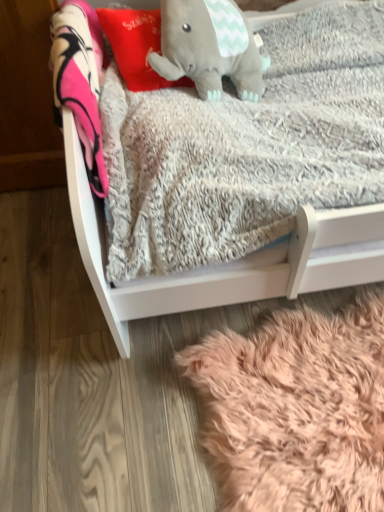
Describe the element at coordinates (232, 262) in the screenshot. The image size is (384, 512). I see `white soft wood infant bed at center` at that location.

Where is `fuzzy pink rug at lower right`? fuzzy pink rug at lower right is located at coordinates (296, 409).

What do you see at coordinates (296, 409) in the screenshot?
I see `fuzzy pink rug at lower right` at bounding box center [296, 409].

Describe the element at coordinates (136, 46) in the screenshot. This screenshot has height=512, width=384. I see `red plush pillow at upper center` at that location.

Image resolution: width=384 pixels, height=512 pixels. What are the coordinates of `white soft wood infant bed at center` in the screenshot? It's located at (232, 262).

Is gray plush elephant at upper center far away from fuzzy pink rug at lower right?

No, gray plush elephant at upper center is in close proximity to fuzzy pink rug at lower right.

Is gray plush elephant at upper center outside of fuzzy pink rug at lower right?

Yes, gray plush elephant at upper center is not within fuzzy pink rug at lower right.

Does gray plush elephant at upper center have a lesser width compared to fuzzy pink rug at lower right?

Yes, gray plush elephant at upper center is thinner than fuzzy pink rug at lower right.

From the image's perspective, relative to fuzzy pink rug at lower right, is gray plush elephant at upper center above or below?

Clearly, from the image's perspective, gray plush elephant at upper center is above fuzzy pink rug at lower right.

Is red plush pillow at upper center further to camera compared to fuzzy pink rug at lower right?

Yes, red plush pillow at upper center is behind fuzzy pink rug at lower right.

You are a GUI agent. You are given a task and a screenshot of the screen. Output one action in this format:
    pyautogui.click(x=<x>, y=<y>)
    Task: Click on the blanket that is in front of the red plush pillow at upper center
    
    Given the screenshot: What is the action you would take?
    pyautogui.click(x=296, y=409)

Is point (123, 70) in front of point (277, 413)?

No.

From a real-world perspective, who is located lower, red plush pillow at upper center or white soft wood infant bed at center?

white soft wood infant bed at center.

Does red plush pillow at upper center turn towards white soft wood infant bed at center?

Yes, red plush pillow at upper center faces towards white soft wood infant bed at center.

Consider the image. Between red plush pillow at upper center and white soft wood infant bed at center, which one has smaller width?

red plush pillow at upper center.

Considering the sizes of objects red plush pillow at upper center and white soft wood infant bed at center in the image provided, who is taller, red plush pillow at upper center or white soft wood infant bed at center?

Standing taller between the two is white soft wood infant bed at center.

Between white soft wood infant bed at center and red plush pillow at upper center, which one appears on the left side from the viewer's perspective?

Positioned to the left is red plush pillow at upper center.

Consider the image. From a real-world perspective, is white soft wood infant bed at center on top of red plush pillow at upper center?

No, from a real-world perspective, white soft wood infant bed at center is not on top of red plush pillow at upper center.

Which object is more forward, white soft wood infant bed at center or red plush pillow at upper center?

white soft wood infant bed at center.

This screenshot has height=512, width=384. In order to click on throw pillow behind the white soft wood infant bed at center in this screenshot , I will do `click(136, 46)`.

Does gray plush elephant at upper center come in front of white soft wood infant bed at center?

No, it is not.

The height and width of the screenshot is (512, 384). I want to click on infant bed that appears on the right of gray plush elephant at upper center, so click(x=232, y=262).

From the picture: Is white soft wood infant bed at center a part of gray plush elephant at upper center?

No.

From the picture: From a real-world perspective, is gray plush elephant at upper center on white soft wood infant bed at center?

Yes, from a real-world perspective, gray plush elephant at upper center is on top of white soft wood infant bed at center.

Between fuzzy pink rug at lower right and gray plush elephant at upper center, which one has more height?

gray plush elephant at upper center is taller.

Between fuzzy pink rug at lower right and gray plush elephant at upper center, which one appears on the left side from the viewer's perspective?

From the viewer's perspective, gray plush elephant at upper center appears more on the left side.

Is fuzzy pink rug at lower right in front of or behind gray plush elephant at upper center in the image?

Clearly, fuzzy pink rug at lower right is in front of gray plush elephant at upper center.

Image resolution: width=384 pixels, height=512 pixels. In order to click on elephant located on the left of fuzzy pink rug at lower right in this screenshot , I will do `click(209, 48)`.

Is point (184, 63) positioned after point (149, 64)?

No, (184, 63) is closer to viewer.

From a real-world perspective, is gray plush elephant at upper center positioned under red plush pillow at upper center based on gravity?

No, from a real-world perspective, gray plush elephant at upper center is not under red plush pillow at upper center.

Is gray plush elephant at upper center facing away from red plush pillow at upper center?

That's not correct — gray plush elephant at upper center is not looking away from red plush pillow at upper center.

In terms of width, does gray plush elephant at upper center look wider or thinner when compared to red plush pillow at upper center?

Clearly, gray plush elephant at upper center has more width compared to red plush pillow at upper center.

Where is `blanket below the gray plush elephant at upper center (from the image's perspective)`? blanket below the gray plush elephant at upper center (from the image's perspective) is located at coordinates (296, 409).

Locate an element on the screen. throw pillow above the fuzzy pink rug at lower right (from a real-world perspective) is located at coordinates (136, 46).

Looking at the image, which one is located further to fuzzy pink rug at lower right, gray plush elephant at upper center or white soft wood infant bed at center?

Based on the image, gray plush elephant at upper center appears to be further to fuzzy pink rug at lower right.

Which object lies further to the anchor point fuzzy pink rug at lower right, white soft wood infant bed at center or gray plush elephant at upper center?

gray plush elephant at upper center is further to fuzzy pink rug at lower right.

Looking at the image, which one is located further to white soft wood infant bed at center, gray plush elephant at upper center or red plush pillow at upper center?

The object further to white soft wood infant bed at center is red plush pillow at upper center.

From the image, which object appears to be farther from red plush pillow at upper center, gray plush elephant at upper center or fuzzy pink rug at lower right?

fuzzy pink rug at lower right is positioned further to the anchor red plush pillow at upper center.

From the image, which object appears to be farther from red plush pillow at upper center, fuzzy pink rug at lower right or white soft wood infant bed at center?

The object further to red plush pillow at upper center is fuzzy pink rug at lower right.

When comparing their distances from gray plush elephant at upper center, does fuzzy pink rug at lower right or red plush pillow at upper center seem closer?

The object closer to gray plush elephant at upper center is red plush pillow at upper center.

Based on their spatial positions, is fuzzy pink rug at lower right or red plush pillow at upper center closer to white soft wood infant bed at center?

fuzzy pink rug at lower right lies closer to white soft wood infant bed at center than the other object.

Considering their positions, is white soft wood infant bed at center positioned further to red plush pillow at upper center than fuzzy pink rug at lower right?

fuzzy pink rug at lower right.

You are a GUI agent. You are given a task and a screenshot of the screen. Output one action in this format:
    pyautogui.click(x=<x>, y=<y>)
    Task: Click on the infant bed between red plush pillow at upper center and fuzzy pink rug at lower right in the up-down direction
    
    Given the screenshot: What is the action you would take?
    pyautogui.click(x=232, y=262)

Find the location of a particular element. Image resolution: width=384 pixels, height=512 pixels. elephant positioned between white soft wood infant bed at center and red plush pillow at upper center from near to far is located at coordinates (209, 48).

What are the coordinates of `throw pillow between gray plush elephant at upper center and fuzzy pink rug at lower right in the up-down direction` in the screenshot? It's located at (136, 46).

Where is `infant bed between gray plush elephant at upper center and fuzzy pink rug at lower right in the vertical direction`? infant bed between gray plush elephant at upper center and fuzzy pink rug at lower right in the vertical direction is located at coordinates (232, 262).